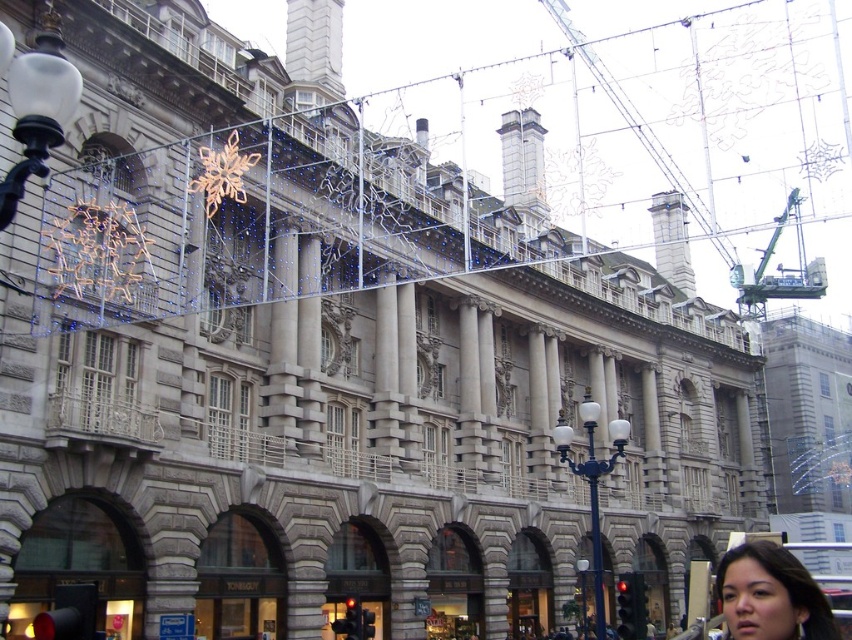
Image resolution: width=852 pixels, height=640 pixels. Identify the location of green metallic crane at upper center. click(707, 193).

Can you confirm if green metallic crane at upper center is positioned to the right of smooth skin face at lower right?

Yes, green metallic crane at upper center is to the right of smooth skin face at lower right.

I want to click on green metallic crane at upper center, so point(707,193).

Who is positioned more to the right, smooth skin face at lower right or green metallic crane at upper right?

green metallic crane at upper right is more to the right.

Which is below, smooth skin face at lower right or green metallic crane at upper right?

smooth skin face at lower right is lower down.

This screenshot has width=852, height=640. In order to click on smooth skin face at lower right in this screenshot , I will do `click(770, 595)`.

Find the location of a particular element. The image size is (852, 640). smooth skin face at lower right is located at coordinates (770, 595).

Is point (697, 205) positioned behind point (799, 253)?

No, (697, 205) is closer to viewer.

Is green metallic crane at upper center below green metallic crane at upper right?

Actually, green metallic crane at upper center is above green metallic crane at upper right.

Which is behind, point (698, 72) or point (730, 285)?

Positioned behind is point (730, 285).

This screenshot has height=640, width=852. I want to click on green metallic crane at upper center, so click(707, 193).